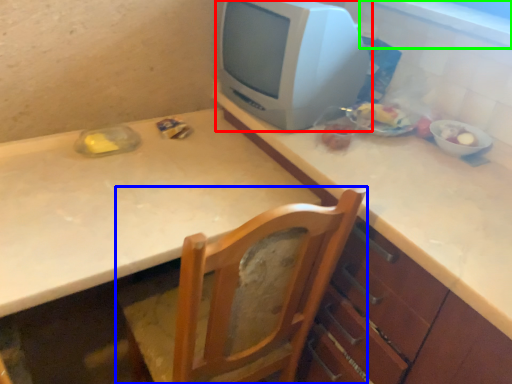
Question: Based on their relative distances, which object is nearer to television (highlighted by a red box)? Choose from chair (highlighted by a blue box) and window sill (highlighted by a green box).

Choices:
 (A) chair
 (B) window sill

Answer: (B)